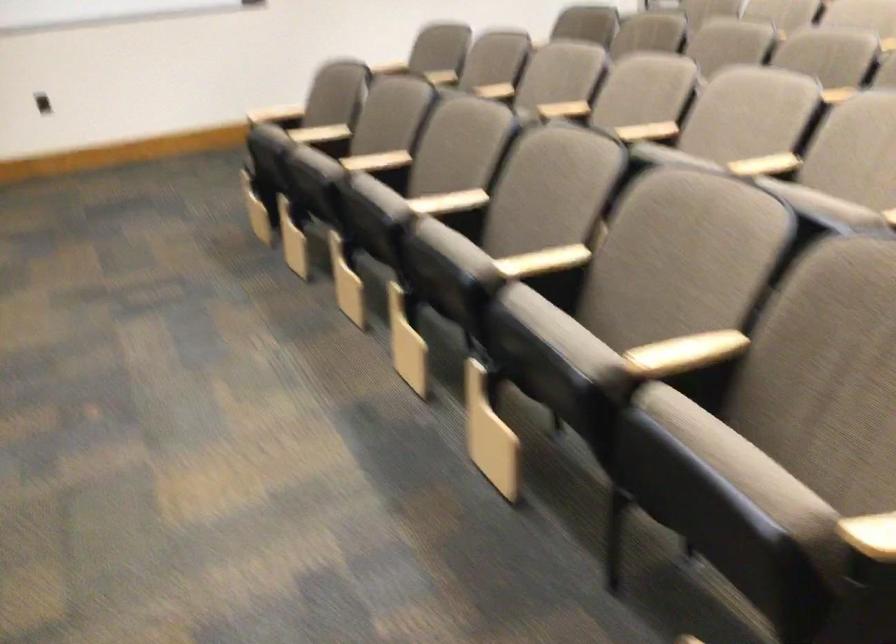
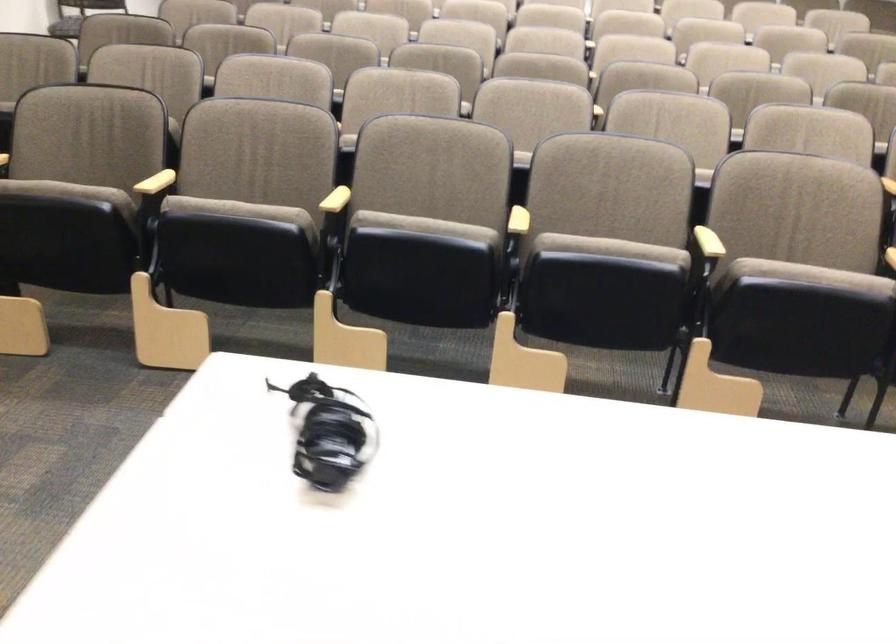
Locate, in the second image, the point that corresponds to the point at 424,201 in the first image.

(518, 221)